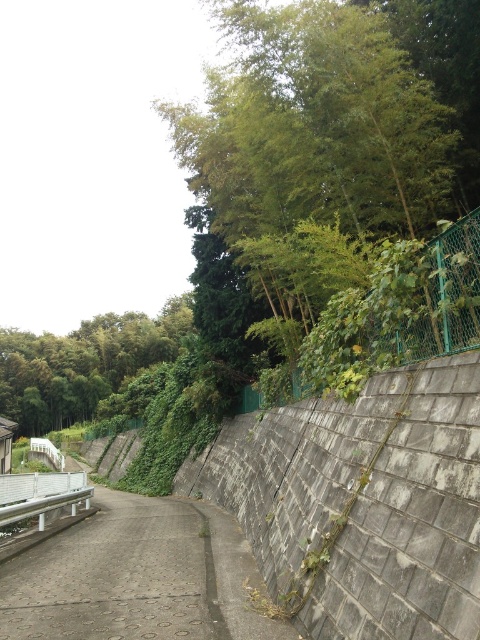
Question: Which point is farther to the camera?

Choices:
 (A) pyautogui.click(x=238, y=161)
 (B) pyautogui.click(x=41, y=509)

Answer: (A)

Question: Is green bamboo at upper right positioned at the back of white glossy rail at lower left?

Choices:
 (A) no
 (B) yes

Answer: (A)

Question: Does green bamboo at upper right lie in front of white glossy rail at lower left?

Choices:
 (A) no
 (B) yes

Answer: (B)

Question: Which of the following is the farthest from the observer?

Choices:
 (A) white glossy rail at lower left
 (B) green bamboo at upper right
 (C) green leafy tree at upper left

Answer: (C)

Question: Which object appears closest to the camera in this image?

Choices:
 (A) green bamboo at upper right
 (B) green leafy tree at upper left
 (C) white glossy rail at lower left

Answer: (A)

Question: Can you confirm if green leafy tree at upper left is positioned above white glossy rail at lower left?

Choices:
 (A) no
 (B) yes

Answer: (B)